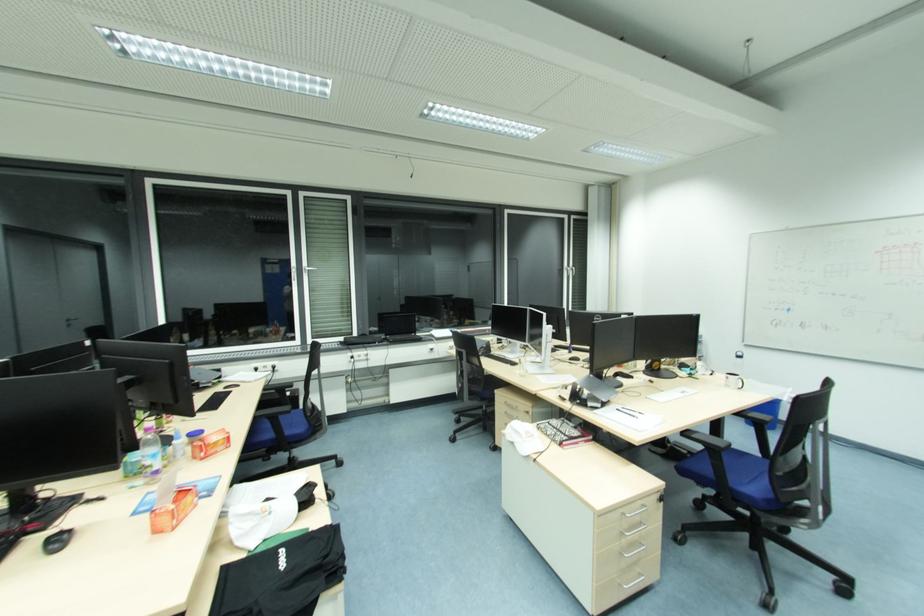
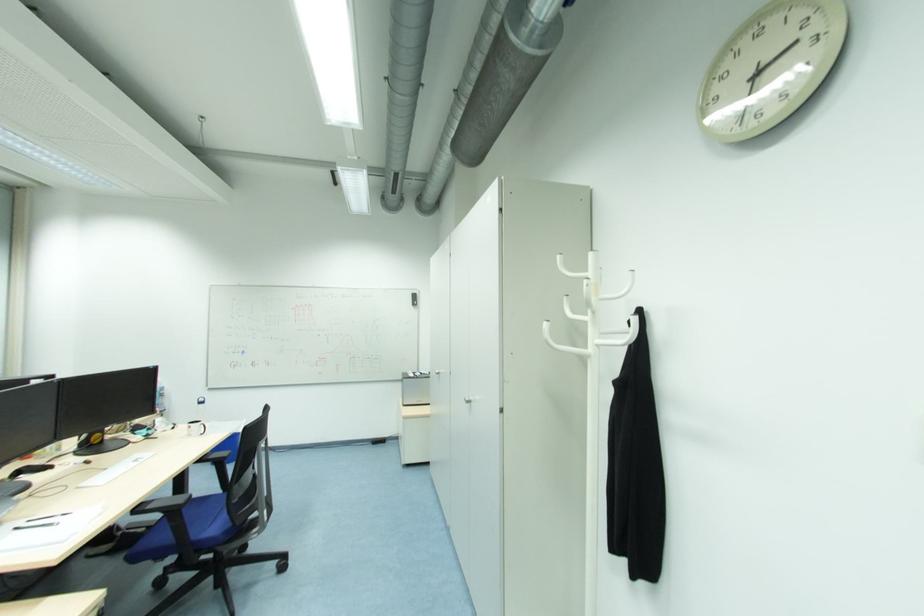
The point at (x=731, y=379) is marked in the first image. Where is the corresponding point in the second image?

(192, 429)